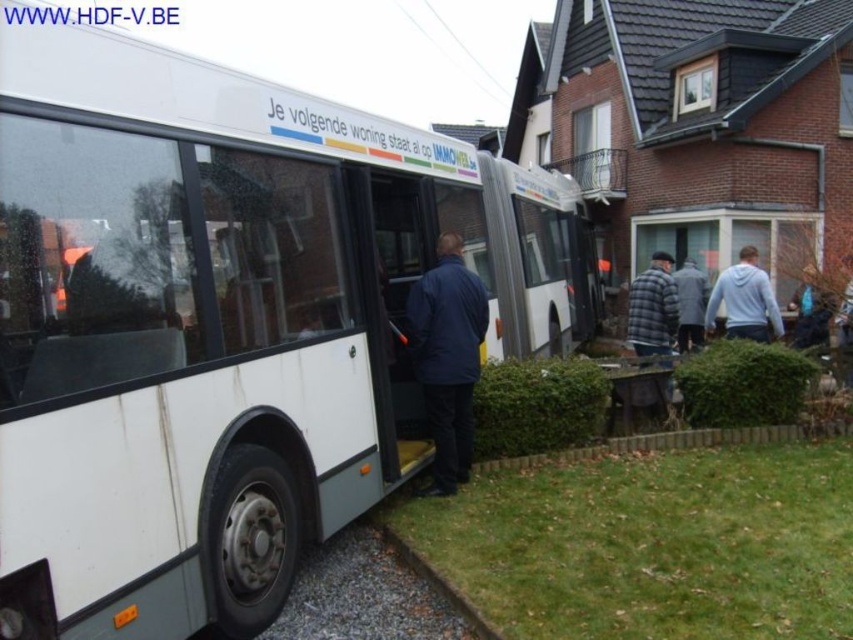
Question: Can you confirm if plaid fabric jacket at center is bigger than dark gray jacket at center?

Choices:
 (A) no
 (B) yes

Answer: (A)

Question: Considering the real-world distances, which object is closest to the white matte bus at center?

Choices:
 (A) dark blue jacket at center
 (B) light gray hoodie at right
 (C) plaid fabric jacket at center
 (D) wooden bench at lower right

Answer: (A)

Question: Which object is the closest to the dark blue jacket at center?

Choices:
 (A) light gray hoodie at right
 (B) wooden bench at lower right
 (C) plaid fabric jacket at center
 (D) white matte bus at center

Answer: (D)

Question: Based on their relative distances, which object is farther from the dark blue jacket at center?

Choices:
 (A) white matte bus at center
 (B) dark gray jacket at center

Answer: (B)

Question: Does light gray hoodie at right have a lesser width compared to plaid fabric jacket at center?

Choices:
 (A) no
 (B) yes

Answer: (A)

Question: Does dark blue jacket at center appear under wooden bench at lower right?

Choices:
 (A) no
 (B) yes

Answer: (A)